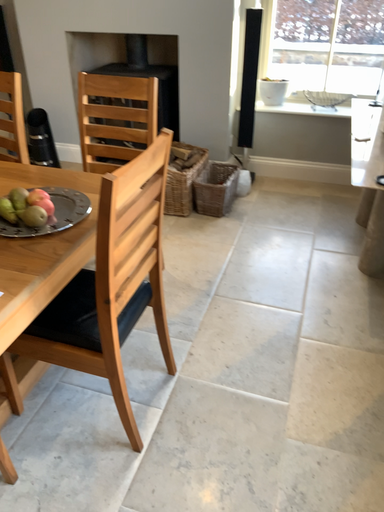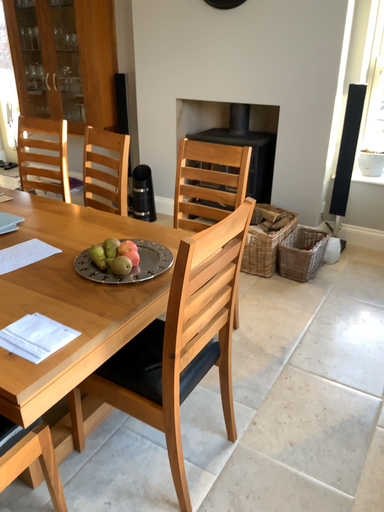
Question: How did the camera likely rotate when shooting the video?

Choices:
 (A) rotated upward
 (B) rotated downward

Answer: (A)